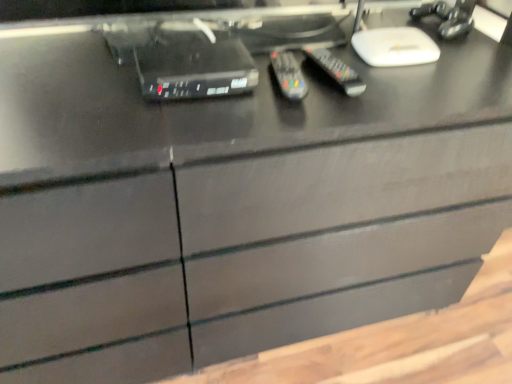
What do you see at coordinates (194, 69) in the screenshot? I see `black plastic device at upper center` at bounding box center [194, 69].

How much space does black plastic remote at center, placed as the second control when sorted from right to left, occupy vertically?

1.43 inches.

This screenshot has height=384, width=512. What are the coordinates of `black plastic device at upper center` in the screenshot? It's located at (194, 69).

From a real-world perspective, is black plastic remote at center, placed as the 1th control when sorted from left to right, physically below black plastic device at upper center?

Correct, in the physical world, black plastic remote at center, placed as the 1th control when sorted from left to right, is lower than black plastic device at upper center.

Considering their positions, is black plastic remote at center, placed as the 1th control when sorted from left to right, located in front of or behind black plastic device at upper center?

black plastic remote at center, placed as the 1th control when sorted from left to right, is behind black plastic device at upper center.

How distant is black plastic remote at center, placed as the 1th control when sorted from left to right, from black plastic device at upper center?

black plastic remote at center, placed as the 1th control when sorted from left to right, is 5.36 inches from black plastic device at upper center.

In the scene shown: In the image, is black plastic remote at center, placed as the second control when sorted from right to left, on the left side or the right side of black plastic device at upper center?

black plastic remote at center, placed as the second control when sorted from right to left, is positioned on black plastic device at upper center's right side.

Considering the relative sizes of black plastic remote at center, the second control when ordered from left to right, and black plastic remote at center, placed as the 1th control when sorted from left to right, in the image provided, is black plastic remote at center, the second control when ordered from left to right, thinner than black plastic remote at center, placed as the 1th control when sorted from left to right,?

In fact, black plastic remote at center, the second control when ordered from left to right, might be wider than black plastic remote at center, placed as the 1th control when sorted from left to right.

Where is `control on the left side of black plastic remote at center, the second control when ordered from left to right`? The height and width of the screenshot is (384, 512). control on the left side of black plastic remote at center, the second control when ordered from left to right is located at coordinates (289, 75).

Who is shorter, black plastic remote at center, the second control when ordered from left to right, or black plastic remote at center, placed as the 1th control when sorted from left to right?

black plastic remote at center, placed as the 1th control when sorted from left to right, is shorter.

Which object is positioned more to the right, black plastic remote at center, the second control when ordered from left to right, or black plastic remote at center, placed as the 1th control when sorted from left to right?

From the viewer's perspective, black plastic remote at center, the second control when ordered from left to right, appears more on the right side.

Does black plastic device at upper center turn towards black plastic remote at center, the second control when ordered from left to right?

No, black plastic device at upper center is not oriented towards black plastic remote at center, the second control when ordered from left to right.

Is black plastic remote at center, acting as the first control starting from the right, located within black plastic device at upper center?

Definitely not — black plastic remote at center, acting as the first control starting from the right, is not inside black plastic device at upper center.

In the image, is black plastic device at upper center on the left side or the right side of black plastic remote at center, the second control when ordered from left to right?

Clearly, black plastic device at upper center is on the left of black plastic remote at center, the second control when ordered from left to right, in the image.

Can you confirm if black plastic device at upper center is taller than black plastic remote at center, acting as the first control starting from the right?

Correct, black plastic device at upper center is much taller as black plastic remote at center, acting as the first control starting from the right.

Consider the image. Considering the relative sizes of black plastic remote at center, acting as the first control starting from the right, and black plastic device at upper center in the image provided, is black plastic remote at center, acting as the first control starting from the right, bigger than black plastic device at upper center?

Actually, black plastic remote at center, acting as the first control starting from the right, might be smaller than black plastic device at upper center.

Image resolution: width=512 pixels, height=384 pixels. I want to click on equipment that is on the left side of black plastic remote at center, acting as the first control starting from the right, so click(x=194, y=69).

From a real-world perspective, is black plastic remote at center, the second control when ordered from left to right, on black plastic device at upper center?

No.

Are black plastic remote at center, the second control when ordered from left to right, and black plastic device at upper center located far from each other?

No, black plastic remote at center, the second control when ordered from left to right, is not far from black plastic device at upper center.

Would you consider black plastic remote at center, placed as the second control when sorted from right to left, to be distant from black plastic remote at center, the second control when ordered from left to right?

That's not correct — black plastic remote at center, placed as the second control when sorted from right to left, is a little close to black plastic remote at center, the second control when ordered from left to right.

Which of these two, black plastic remote at center, placed as the second control when sorted from right to left, or black plastic remote at center, acting as the first control starting from the right, is wider?

With larger width is black plastic remote at center, acting as the first control starting from the right.

Does point (288, 52) come farther from viewer compared to point (349, 79)?

Yes, point (288, 52) is farther from viewer.

Do you think black plastic remote at center, placed as the 1th control when sorted from left to right, is within black plastic remote at center, acting as the first control starting from the right, or outside of it?

The correct answer is: outside.

Could you measure the distance between black plastic device at upper center and black plastic remote at center, placed as the 1th control when sorted from left to right?

The distance of black plastic device at upper center from black plastic remote at center, placed as the 1th control when sorted from left to right, is 5.36 inches.

From the image's perspective, between black plastic device at upper center and black plastic remote at center, placed as the 1th control when sorted from left to right, which one is located above?

black plastic device at upper center.

In terms of width, does black plastic device at upper center look wider or thinner when compared to black plastic remote at center, placed as the 1th control when sorted from left to right?

black plastic device at upper center is thinner than black plastic remote at center, placed as the 1th control when sorted from left to right.

From a real-world perspective, which object stands above the other?

black plastic device at upper center, from a real-world perspective.

Find the location of `equipment that appears on the left of black plastic remote at center, placed as the 1th control when sorted from left to right`. equipment that appears on the left of black plastic remote at center, placed as the 1th control when sorted from left to right is located at coordinates (194, 69).

Identify the location of control that appears above the black plastic remote at center, placed as the 1th control when sorted from left to right (from a real-world perspective). (337, 71).

Looking at the image, which one is located further to black plastic remote at center, placed as the 1th control when sorted from left to right, black plastic device at upper center or black plastic remote at center, acting as the first control starting from the right?

The object further to black plastic remote at center, placed as the 1th control when sorted from left to right, is black plastic device at upper center.

Based on their spatial positions, is black plastic remote at center, placed as the second control when sorted from right to left, or black plastic device at upper center closer to black plastic remote at center, acting as the first control starting from the right?

black plastic remote at center, placed as the second control when sorted from right to left, lies closer to black plastic remote at center, acting as the first control starting from the right, than the other object.

Based on their spatial positions, is black plastic remote at center, acting as the first control starting from the right, or black plastic device at upper center further from black plastic remote at center, placed as the 1th control when sorted from left to right?

The object further to black plastic remote at center, placed as the 1th control when sorted from left to right, is black plastic device at upper center.

From the image, which object appears to be farther from black plastic remote at center, the second control when ordered from left to right, black plastic device at upper center or black plastic remote at center, placed as the second control when sorted from right to left?

Among the two, black plastic device at upper center is located further to black plastic remote at center, the second control when ordered from left to right.

Estimate the real-world distances between objects in this image. Which object is further from black plastic device at upper center, black plastic remote at center, placed as the 1th control when sorted from left to right, or black plastic remote at center, acting as the first control starting from the right?

Among the two, black plastic remote at center, acting as the first control starting from the right, is located further to black plastic device at upper center.

From the image, which object appears to be nearer to black plastic device at upper center, black plastic remote at center, the second control when ordered from left to right, or black plastic remote at center, placed as the 1th control when sorted from left to right?

Among the two, black plastic remote at center, placed as the 1th control when sorted from left to right, is located nearer to black plastic device at upper center.

The width and height of the screenshot is (512, 384). What are the coordinates of `control located between black plastic device at upper center and black plastic remote at center, the second control when ordered from left to right, in the left-right direction` in the screenshot? It's located at (289, 75).